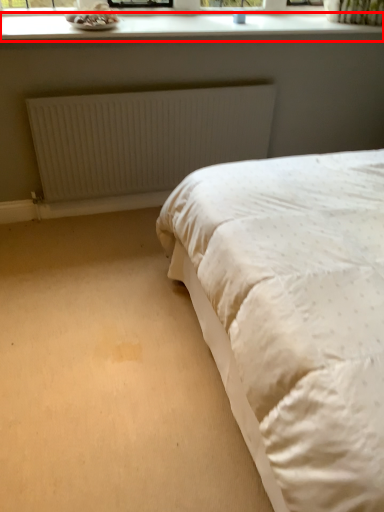
Question: From the image's perspective, considering the relative positions of window sill (annotated by the red box) and radiator in the image provided, where is window sill (annotated by the red box) located with respect to the staircase?

Choices:
 (A) above
 (B) below

Answer: (A)